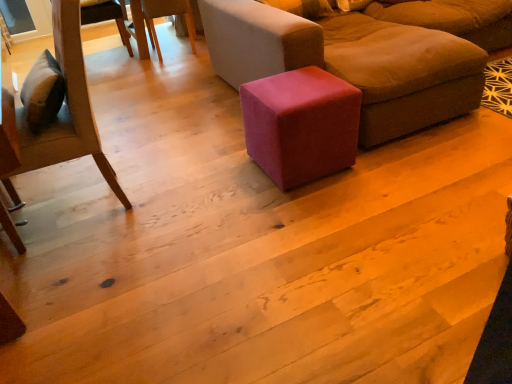
At what (x,y) coordinates should I click in order to perform the action: click on vacant space to the right of velvet pink cube at center. Please return your answer as a coordinate pair (x, y). Looking at the image, I should click on (390, 161).